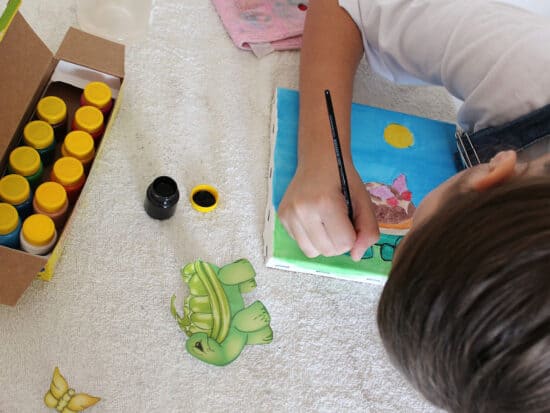
Where is `pink napkin`? The width and height of the screenshot is (550, 413). pink napkin is located at coordinates (272, 25).